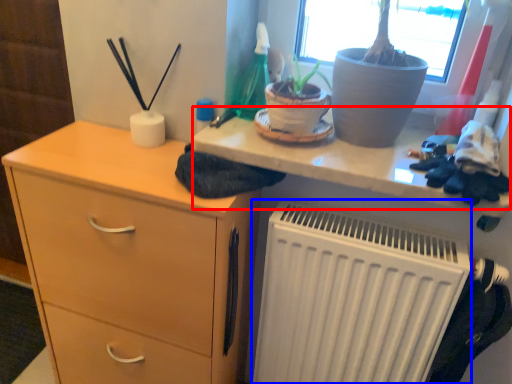
Question: Which of the following is the closest to the observer, writing desk (highlighted by a red box) or radiator (highlighted by a blue box)?

Choices:
 (A) writing desk
 (B) radiator

Answer: (A)